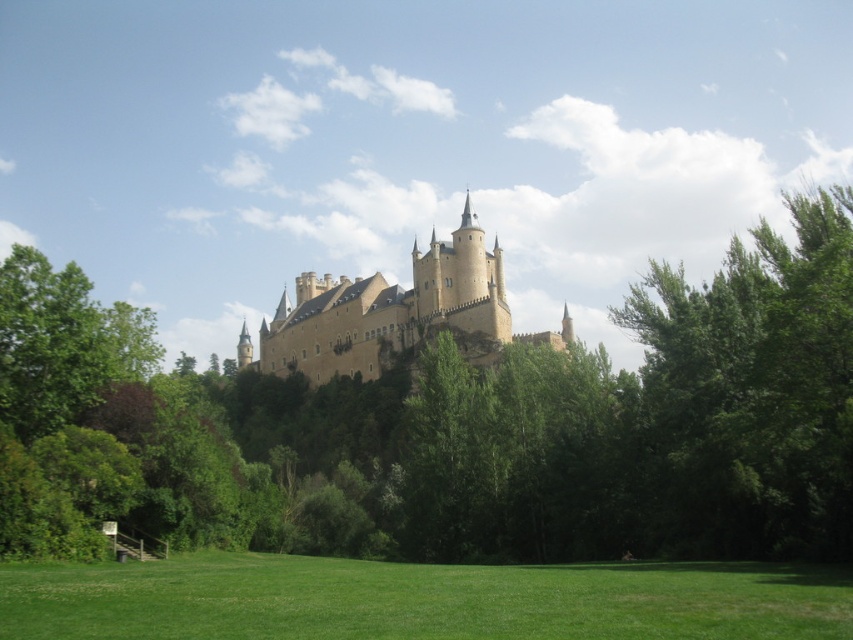
You are a gardener standing at the base of the hill looking up at the castle. You notice the green leafy tree at right and the green grass at lower center. Which object is located higher up the hill?

The green leafy tree at right is positioned over the green grass at lower center, so it is higher up the hill.

You are a visitor approaching the castle and want to take a photo that includes both the green leafy tree at right and the brown stone castle at center. Based on their sizes, which object should you focus on first to ensure both fit in the frame?

The green leafy tree at right is larger than the brown stone castle at center, so you should focus on the green leafy tree at right first to ensure both fit in the frame.